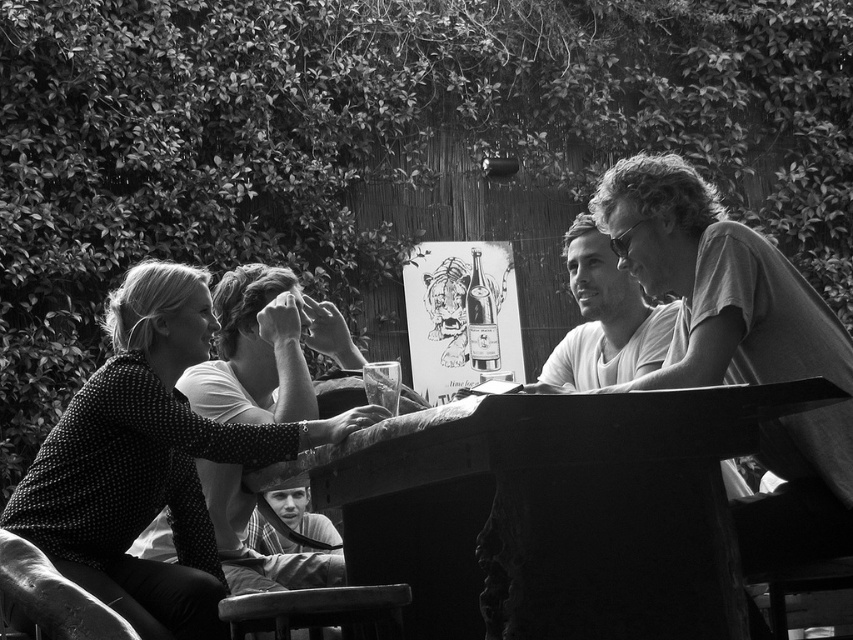
Is point (125, 285) farther from viewer compared to point (288, 483)?

Yes.

The width and height of the screenshot is (853, 640). What are the coordinates of `polka dot fabric shirt at left` in the screenshot? It's located at (148, 461).

Which is behind, point (323, 484) or point (251, 538)?

The point (251, 538) is behind.

Between point (567, 512) and point (322, 522), which one is positioned behind?

Positioned behind is point (322, 522).

You are a GUI agent. You are given a task and a screenshot of the screen. Output one action in this format:
    pyautogui.click(x=<x>, y=<y>)
    Task: Click on the smooth wooden table at center
    
    Given the screenshot: What is the action you would take?
    pyautogui.click(x=564, y=506)

Which is behind, point (84, 516) or point (625, 352)?

Positioned behind is point (625, 352).

Can you confirm if polka dot fabric shirt at left is wider than smooth white shirt at center?

Indeed, polka dot fabric shirt at left has a greater width compared to smooth white shirt at center.

At what (x,y) coordinates should I click in order to perform the action: click on polka dot fabric shirt at left. Please return your answer as a coordinate pair (x, y). The height and width of the screenshot is (640, 853). Looking at the image, I should click on (148, 461).